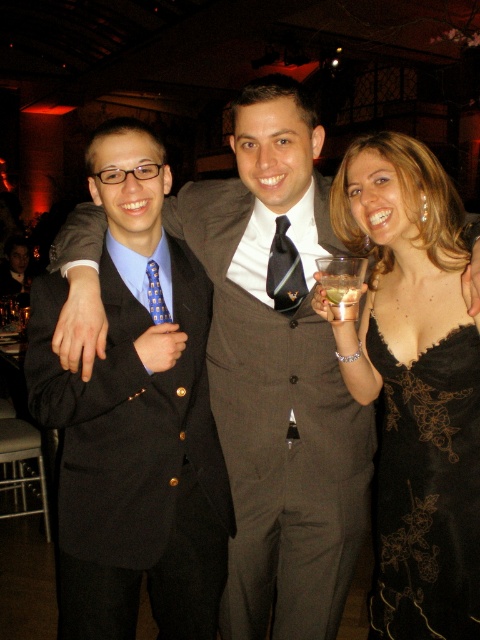
You are at the center of the image and want to move towards the black lace dress at lower right. Which direction should you move?

You should move towards the lower right direction to reach the black lace dress at lower right.

You are standing at the entrance of the event venue and want to find the black lace dress at lower right. According to the coordinates provided, in which direction should you look relative to the center of the image?

The black lace dress at lower right is located at point (427, 490), which means it is positioned to the right and slightly below the center of the image. Therefore, you should look towards the lower right direction from the center to find it.

You are a photographer at a formal event and need to adjust the lighting to highlight both the black silk tie at center and the matte black suit at center. Since both are dark, how can you ensure they are distinguishable in the photo?

The black silk tie at center is positioned on the right side of matte black suit at center, so adjusting the lighting to create a slight shadow or highlight on the right side will help distinguish the tie from the suit.